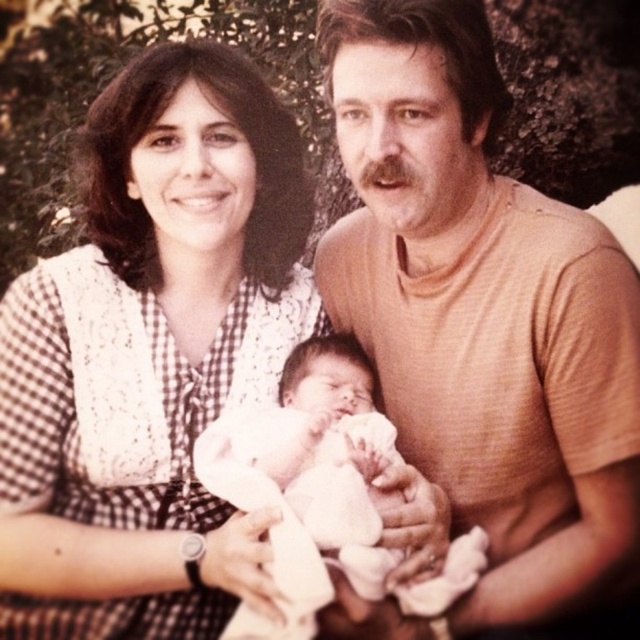
Question: Is orange smooth t-shirt at center positioned behind white soft cloth at center?

Choices:
 (A) no
 (B) yes

Answer: (A)

Question: Does orange smooth t-shirt at center have a smaller size compared to white soft cloth at center?

Choices:
 (A) no
 (B) yes

Answer: (A)

Question: Which object is farther from the camera taking this photo?

Choices:
 (A) white checkered dress at center
 (B) orange smooth t-shirt at center

Answer: (A)

Question: Is white checkered dress at center behind orange smooth t-shirt at center?

Choices:
 (A) no
 (B) yes

Answer: (B)

Question: Which of the following is the farthest from the observer?

Choices:
 (A) (148, 531)
 (B) (520, 403)
 (C) (308, 365)

Answer: (C)

Question: Which is nearer to the white checkered dress at center?

Choices:
 (A) white soft cloth at center
 (B) orange smooth t-shirt at center

Answer: (A)